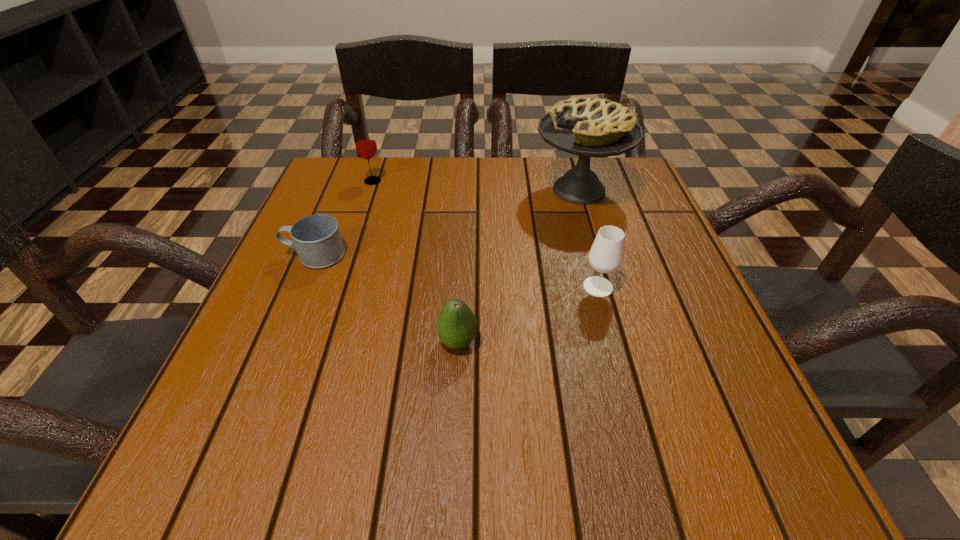
Locate an element on the screen. pie is located at coordinates (584, 126).

Find the location of `the farther glass`. the farther glass is located at coordinates click(365, 143).

Where is `the right glass`? the right glass is located at coordinates (606, 254).

The width and height of the screenshot is (960, 540). Identify the location of the nearer glass. (606, 254).

This screenshot has height=540, width=960. In order to click on the nearest object in this screenshot , I will do `click(457, 325)`.

Find the location of a particular element. The width and height of the screenshot is (960, 540). the second shortest object is located at coordinates (457, 325).

Where is `the third nearest object`? The height and width of the screenshot is (540, 960). the third nearest object is located at coordinates (316, 238).

Where is `mug`? The image size is (960, 540). mug is located at coordinates (316, 238).

Where is `vacant position located on the cut side of the tallest object`? vacant position located on the cut side of the tallest object is located at coordinates (418, 190).

The height and width of the screenshot is (540, 960). Find the location of `vacant region located on the cut side of the tallest object`. vacant region located on the cut side of the tallest object is located at coordinates (369, 190).